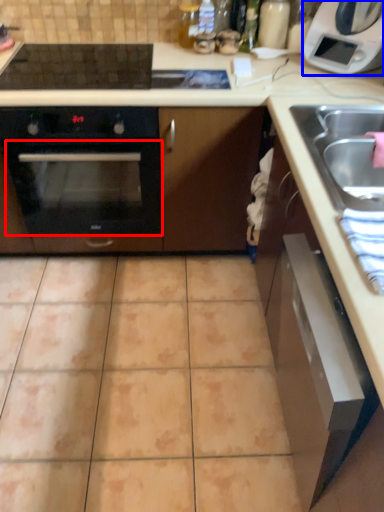
Question: Among these objects, which one is nearest to the camera, oven (highlighted by a red box) or home appliance (highlighted by a blue box)?

Choices:
 (A) oven
 (B) home appliance

Answer: (B)